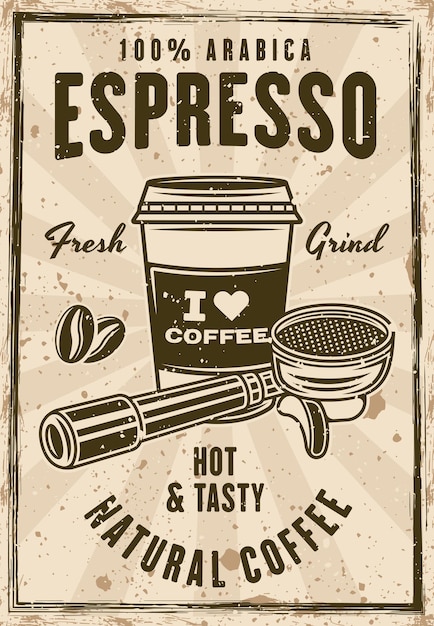
I want to click on cup, so click(200, 237).